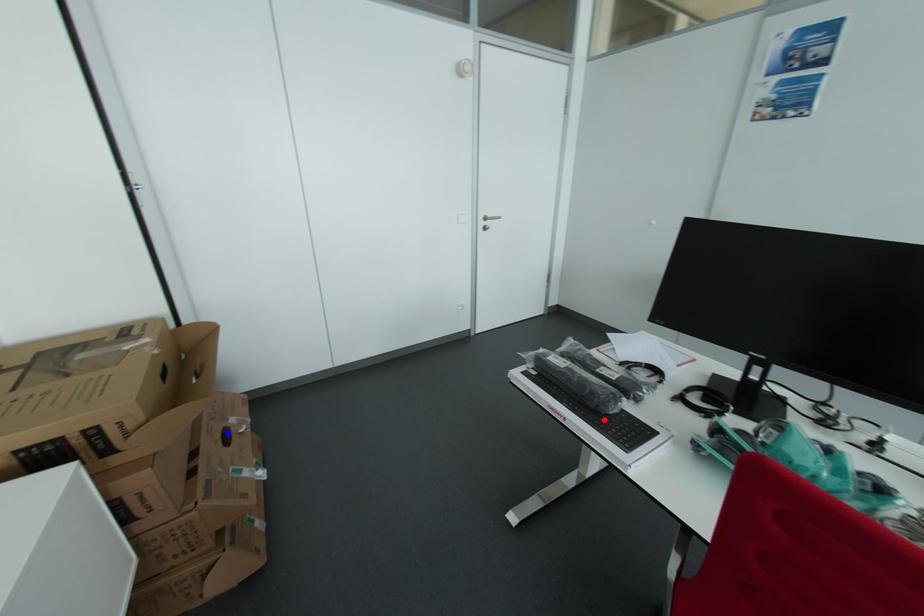
Question: Two points are marked on the image. Which point is closer to the camera?

Choices:
 (A) Blue point is closer.
 (B) Red point is closer.

Answer: (B)